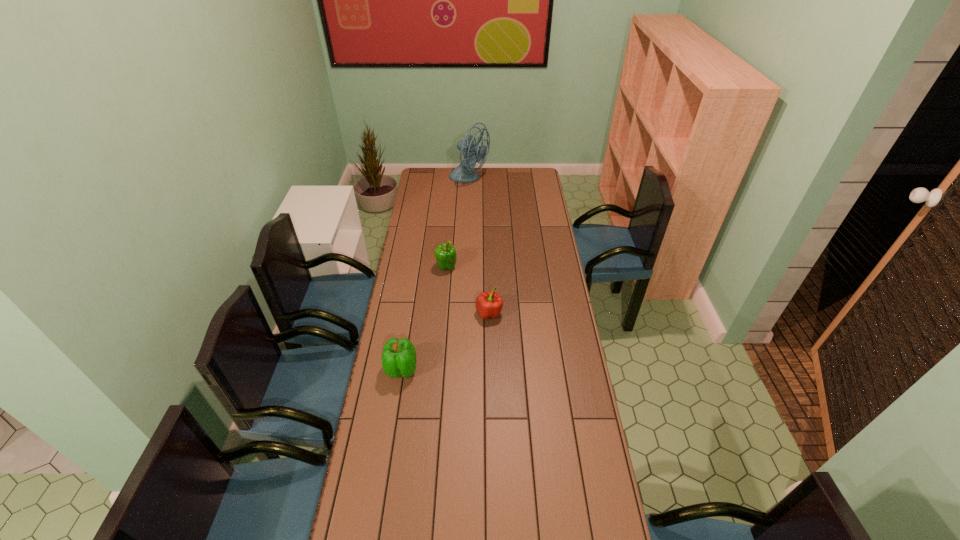
This screenshot has width=960, height=540. I want to click on the tallest object, so click(464, 172).

Find the location of a particular element. The image size is (960, 540). fan is located at coordinates (464, 172).

Image resolution: width=960 pixels, height=540 pixels. I want to click on the third nearest object, so click(x=445, y=254).

This screenshot has width=960, height=540. In order to click on the second bell pepper from right to left in this screenshot , I will do `click(445, 254)`.

At what (x,y) coordinates should I click in order to perform the action: click on the leftmost bell pepper. Please return your answer as a coordinate pair (x, y). This screenshot has height=540, width=960. Looking at the image, I should click on (399, 359).

Image resolution: width=960 pixels, height=540 pixels. I want to click on the nearest object, so click(x=399, y=359).

This screenshot has height=540, width=960. I want to click on the rightmost bell pepper, so click(489, 305).

You are a GUI agent. You are given a task and a screenshot of the screen. Output one action in this format:
    pyautogui.click(x=<x>, y=<y>)
    Task: Click on the third farthest object
    
    Given the screenshot: What is the action you would take?
    pyautogui.click(x=489, y=305)

The image size is (960, 540). I want to click on free space located in front of the farthest object to blow air, so click(505, 179).

Where is `vacant area located on the front of the second bell pepper from left to right`? The width and height of the screenshot is (960, 540). vacant area located on the front of the second bell pepper from left to right is located at coordinates pyautogui.click(x=444, y=286).